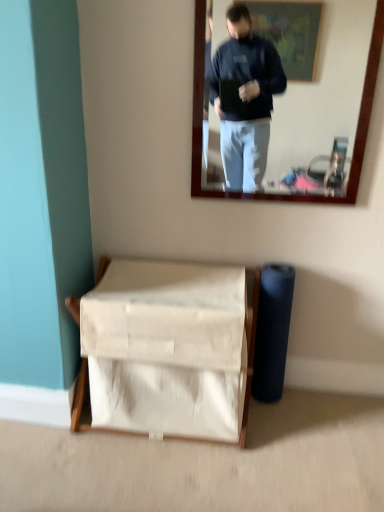
The height and width of the screenshot is (512, 384). What do you see at coordinates (285, 99) in the screenshot? I see `matte wooden mirror at upper center` at bounding box center [285, 99].

Locate an element on the screen. The image size is (384, 512). matte wooden mirror at upper center is located at coordinates (285, 99).

This screenshot has height=512, width=384. Describe the element at coordinates (169, 349) in the screenshot. I see `white fabric basket at lower center` at that location.

Measure the distance between point (165,325) and camera.

Point (165,325) and camera are 1.42 meters apart.

Where is `white fabric basket at lower center`? The width and height of the screenshot is (384, 512). white fabric basket at lower center is located at coordinates (169, 349).

What is the approximate height of white fabric basket at lower center?

It is 24.03 inches.

In order to face white fabric basket at lower center, should I rotate leftwards or rightwards?

Rotate left and turn 3.551 degrees.

Find the location of a particular element. matte wooden mirror at upper center is located at coordinates (285, 99).

Looking at this image, which object is positioned more to the right, matte wooden mirror at upper center or white fabric basket at lower center?

Positioned to the right is matte wooden mirror at upper center.

Relative to white fabric basket at lower center, is matte wooden mirror at upper center in front or behind?

matte wooden mirror at upper center is positioned closer to the viewer than white fabric basket at lower center.

Which is in front, point (250, 11) or point (139, 277)?

The point (139, 277) is closer to the camera.

From the image's perspective, is matte wooden mirror at upper center located beneath white fabric basket at lower center?

Actually, matte wooden mirror at upper center appears above white fabric basket at lower center in the image.

From a real-world perspective, is matte wooden mirror at upper center above or below white fabric basket at lower center?

In terms of real-world spatial position, matte wooden mirror at upper center is above white fabric basket at lower center.

Does matte wooden mirror at upper center have a greater width compared to white fabric basket at lower center?

No.

Considering the sizes of objects matte wooden mirror at upper center and white fabric basket at lower center in the image provided, who is taller, matte wooden mirror at upper center or white fabric basket at lower center?

Standing taller between the two is matte wooden mirror at upper center.

Looking at the image, does matte wooden mirror at upper center seem bigger or smaller compared to white fabric basket at lower center?

Considering their sizes, matte wooden mirror at upper center takes up less space than white fabric basket at lower center.

Can we say matte wooden mirror at upper center lies outside white fabric basket at lower center?

matte wooden mirror at upper center lies outside white fabric basket at lower center's area.

Is matte wooden mirror at upper center beside white fabric basket at lower center?

matte wooden mirror at upper center and white fabric basket at lower center are not in contact.

Could you tell me if matte wooden mirror at upper center is facing white fabric basket at lower center?

No.

How many degrees apart are the facing directions of matte wooden mirror at upper center and white fabric basket at lower center?

matte wooden mirror at upper center and white fabric basket at lower center are facing 0.00251 degrees away from each other.

You are a GUI agent. You are given a task and a screenshot of the screen. Output one action in this format:
    pyautogui.click(x=<x>, y=<y>)
    Task: Click on the furniture below the matte wooden mirror at upper center (from the image's perspective)
    
    Given the screenshot: What is the action you would take?
    pyautogui.click(x=169, y=349)

Which object is positioned more to the left, white fabric basket at lower center or matte wooden mirror at upper center?

white fabric basket at lower center.

Considering the relative positions of white fabric basket at lower center and matte wooden mirror at upper center in the image provided, is white fabric basket at lower center behind matte wooden mirror at upper center?

Yes, it is.

Is point (108, 375) positioned behind point (338, 17)?

No, it is in front of (338, 17).

From the image's perspective, does white fabric basket at lower center appear higher than matte wooden mirror at upper center?

Actually, white fabric basket at lower center appears below matte wooden mirror at upper center in the image.

From a real-world perspective, is white fabric basket at lower center located higher than matte wooden mirror at upper center?

No.

Considering the sizes of objects white fabric basket at lower center and matte wooden mirror at upper center in the image provided, who is thinner, white fabric basket at lower center or matte wooden mirror at upper center?

matte wooden mirror at upper center.

Considering the relative sizes of white fabric basket at lower center and matte wooden mirror at upper center in the image provided, is white fabric basket at lower center shorter than matte wooden mirror at upper center?

Yes, white fabric basket at lower center is shorter than matte wooden mirror at upper center.

Does white fabric basket at lower center have a larger size compared to matte wooden mirror at upper center?

Yes, white fabric basket at lower center is bigger than matte wooden mirror at upper center.

Is white fabric basket at lower center inside the boundaries of matte wooden mirror at upper center, or outside?

white fabric basket at lower center is outside matte wooden mirror at upper center.

Can you see white fabric basket at lower center touching matte wooden mirror at upper center?

white fabric basket at lower center and matte wooden mirror at upper center are clearly separated.

Is white fabric basket at lower center looking in the opposite direction of matte wooden mirror at upper center?

No, white fabric basket at lower center is not facing away from matte wooden mirror at upper center.

Identify the location of mirror above the white fabric basket at lower center (from the image's perspective). (285, 99).

What are the coordinates of `mirror above the white fabric basket at lower center (from the image's perspective)` in the screenshot? It's located at (285, 99).

Locate an element on the screen. mirror located in front of the white fabric basket at lower center is located at coordinates (285, 99).